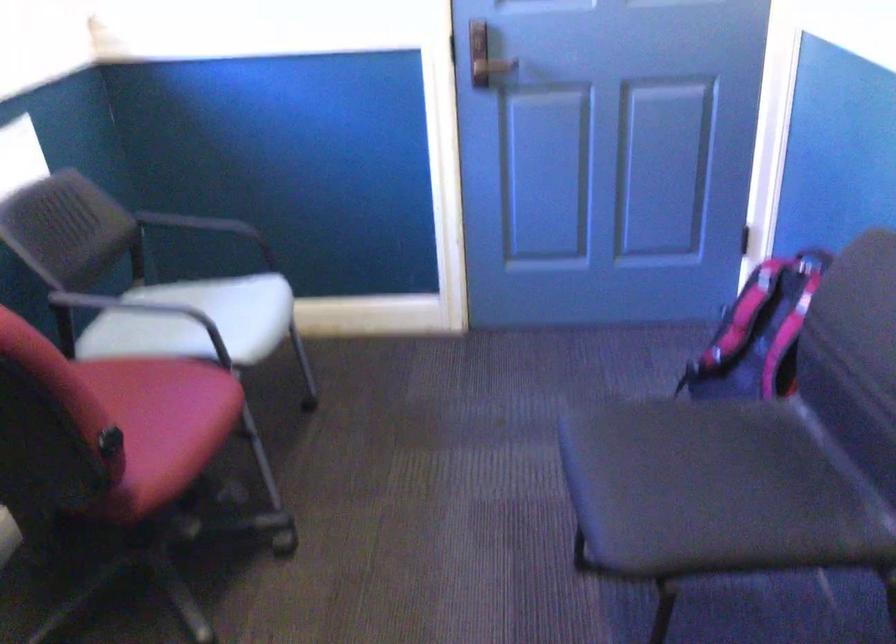
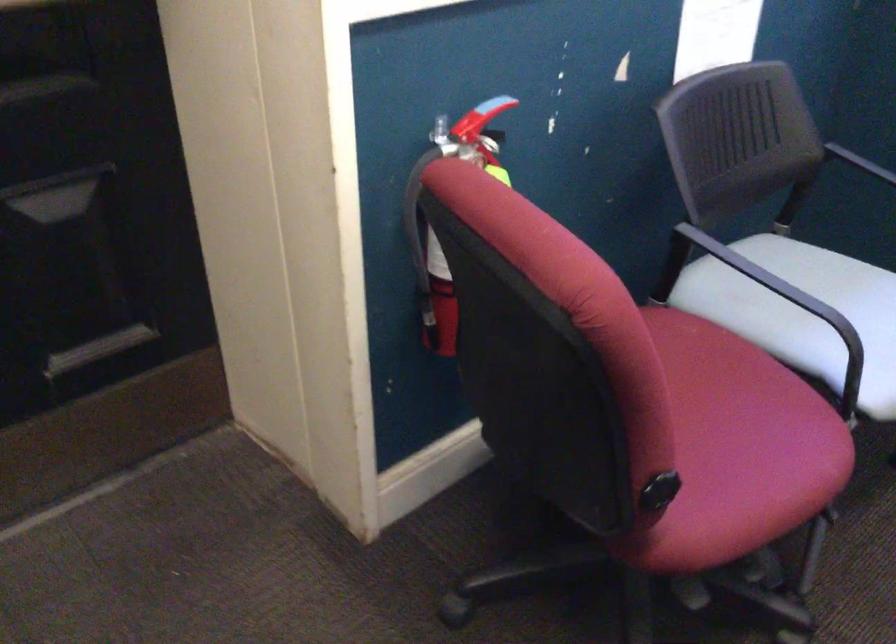
Find the pixel in the second image that matches pixel 200 296 in the first image.

(842, 276)